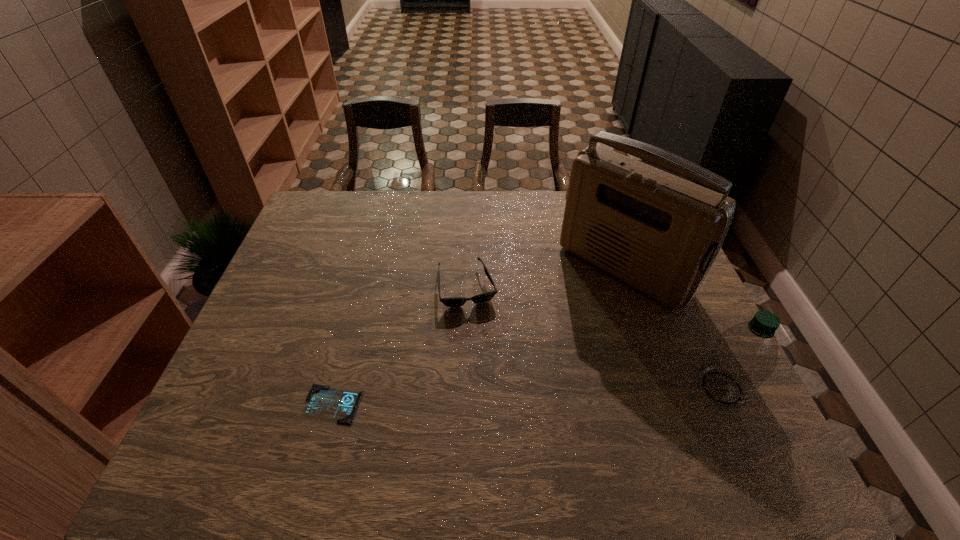
Where is `free space between the water bottle and the sunglasses`? This screenshot has height=540, width=960. free space between the water bottle and the sunglasses is located at coordinates (594, 338).

The width and height of the screenshot is (960, 540). I want to click on free spot between the tallest object and the second tallest object, so click(672, 328).

The width and height of the screenshot is (960, 540). I want to click on free space between the second tallest object and the third object from right to left, so click(x=594, y=338).

Locate an element on the screen. This screenshot has height=540, width=960. free area in between the radio receiver and the second tallest object is located at coordinates (672, 328).

Locate an element on the screen. The image size is (960, 540). unoccupied position between the leftmost object and the third object from right to left is located at coordinates [400, 346].

Locate an element on the screen. vacant space that is in between the tallest object and the shortest object is located at coordinates (478, 336).

You are a GUI agent. You are given a task and a screenshot of the screen. Output one action in this format:
    pyautogui.click(x=<x>, y=<y>)
    Task: Click on the object that is the third nearest to the second tallest object
    
    Given the screenshot: What is the action you would take?
    322,401

Locate which object ranks in proximity to the radio receiver. Please provide its 2D coordinates. Your answer should be formatted as a tuple, i.e. [(x, y)], where the tuple contains the x and y coordinates of a point satisfying the conditions above.

[(743, 356)]

What are the coordinates of `free space in the image that satisfies the following two spatial constraints: 1. on the front side of the third object from right to left; 2. on the right side of the second tallest object` in the screenshot? It's located at (464, 388).